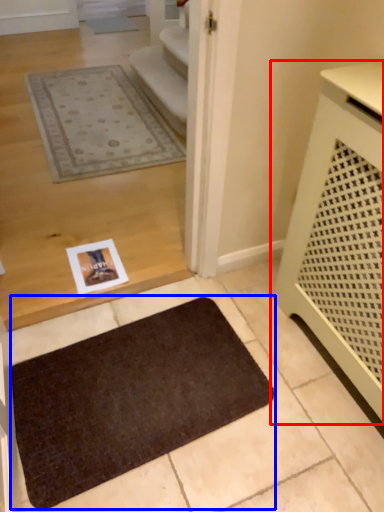
Question: Which object appears closest to the camera in this image, furniture (highlighted by a red box) or mat (highlighted by a blue box)?

Choices:
 (A) furniture
 (B) mat

Answer: (A)